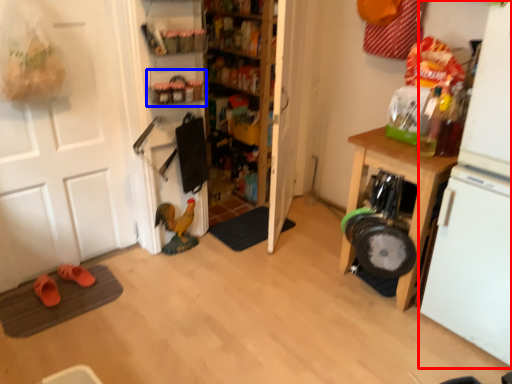
Question: Which object appears farthest to the camera in this image, appliance (highlighted by a red box) or shelf (highlighted by a blue box)?

Choices:
 (A) appliance
 (B) shelf

Answer: (B)